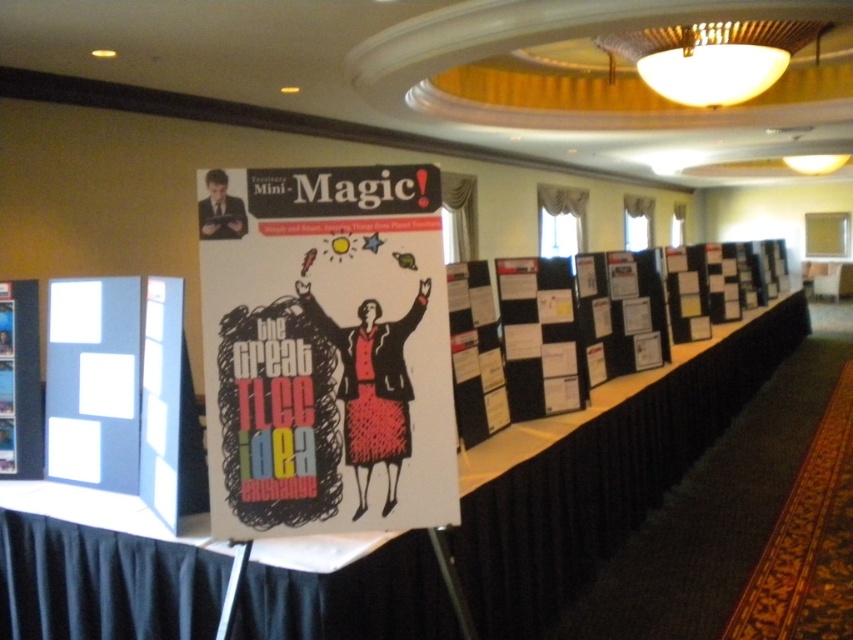
Who is more forward, (204, 216) or (12, 323)?

Positioned in front is point (204, 216).

Can you confirm if matte black poster at center is shorter than white cardboard poster at left?

Incorrect, matte black poster at center's height does not fall short of white cardboard poster at left's.

Is point (372, 305) positioned after point (6, 380)?

No, (372, 305) is in front of (6, 380).

Where is `matte black poster at center`? The height and width of the screenshot is (640, 853). matte black poster at center is located at coordinates (325, 349).